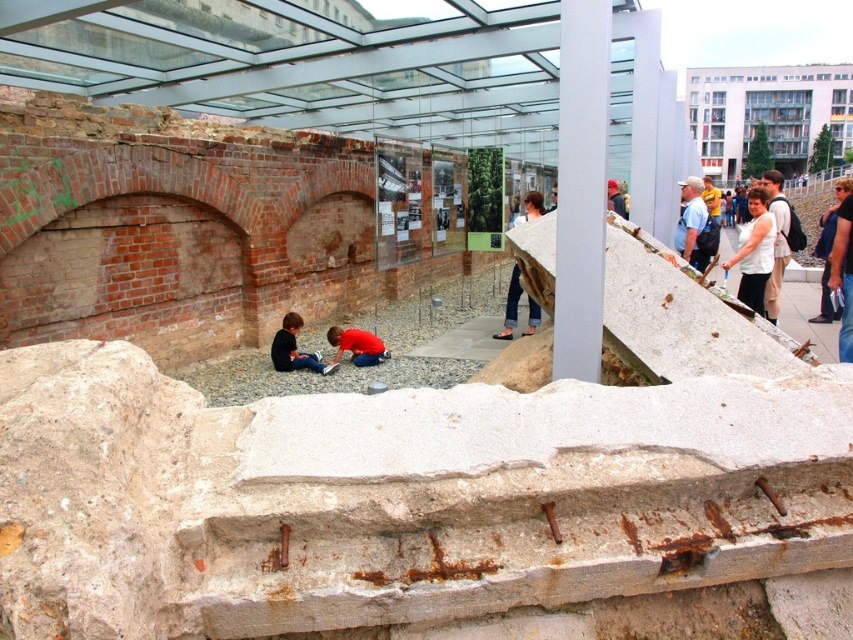
Question: Estimate the real-world distances between objects in this image. Which object is farther from the white smooth pillar at upper center?

Choices:
 (A) denim pants at center
 (B) matte black shirt at center

Answer: (A)

Question: Is matte black shirt at center bigger than red matte shirt at center?

Choices:
 (A) yes
 (B) no

Answer: (A)

Question: Does light blue shirt at upper right lie in front of matte black shirt at center?

Choices:
 (A) yes
 (B) no

Answer: (B)

Question: Which point appears closest to the camera in this image?

Choices:
 (A) (515, 268)
 (B) (693, 179)
 (C) (357, 349)
 (D) (833, 230)

Answer: (C)

Question: Among these objects, which one is farthest from the camera?

Choices:
 (A) light blue shirt at upper right
 (B) white cotton shirt at center
 (C) light beige pants at right

Answer: (A)

Question: From the image, what is the correct spatial relationship of white matte shirt at center in relation to light beige pants at right?

Choices:
 (A) right
 (B) left

Answer: (B)